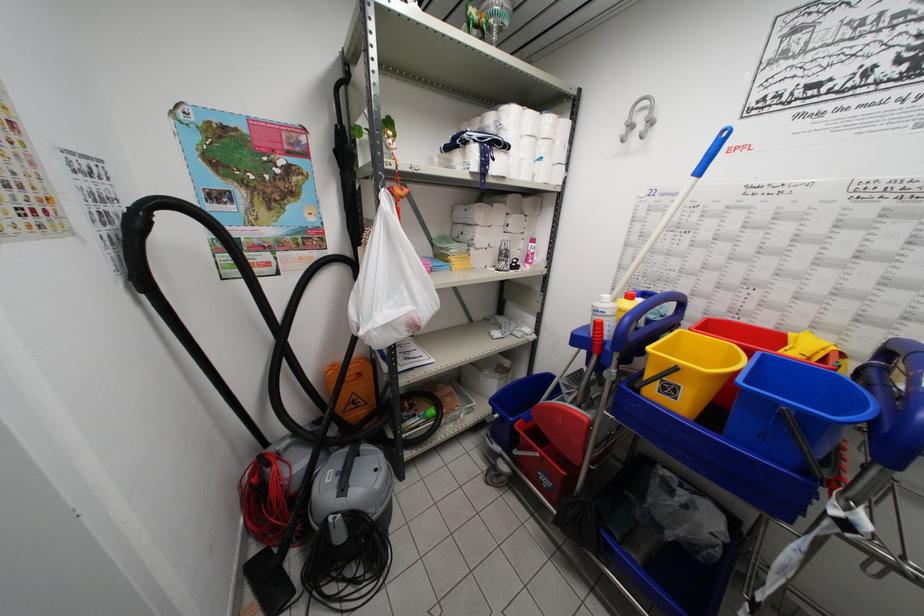
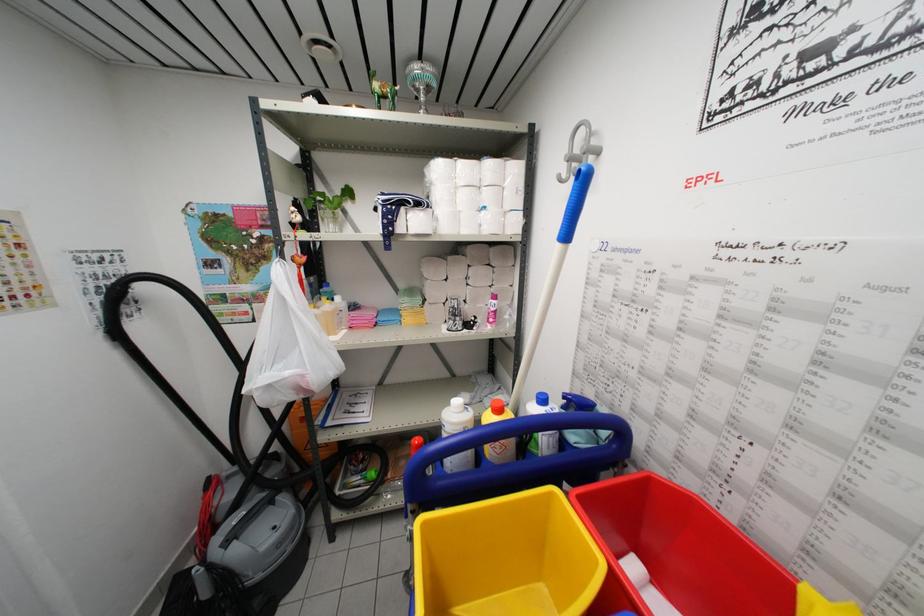
Question: The camera is either moving clockwise (left) or counter-clockwise (right) around the object. The first image is from the beginning of the video and the second image is from the end. Is the camera moving left or right when shooting the video?

Choices:
 (A) Left
 (B) Right

Answer: (B)